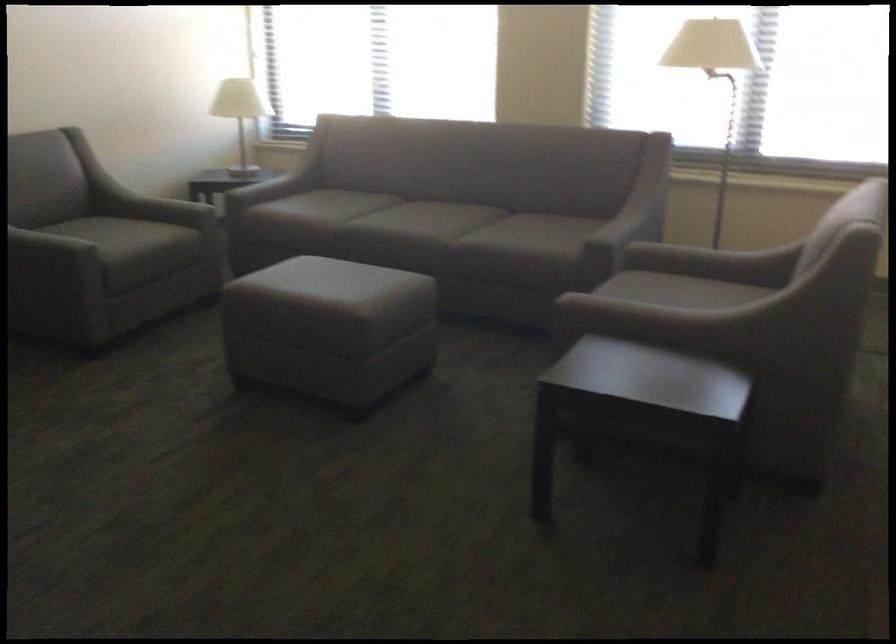
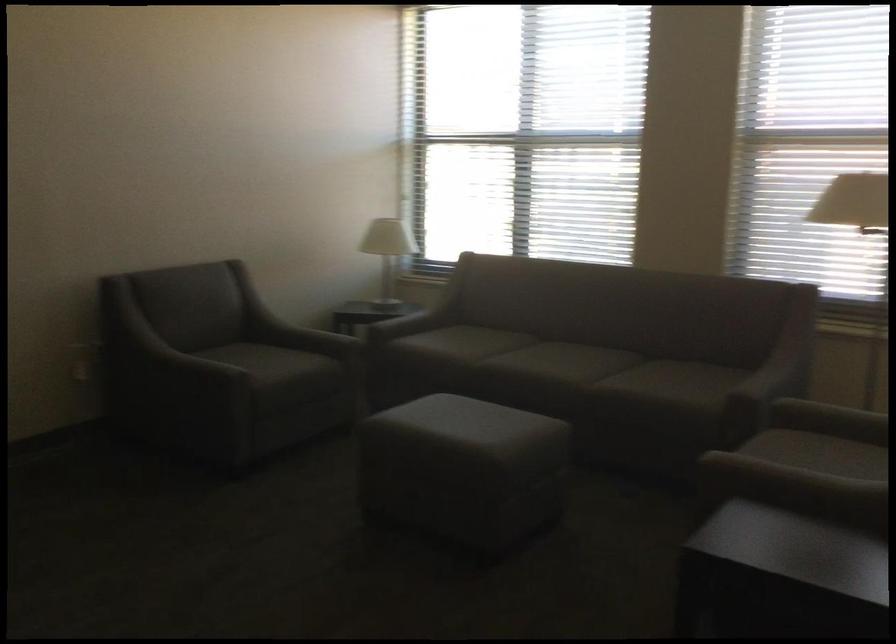
The point at (616, 227) is marked in the first image. Where is the corresponding point in the second image?

(762, 381)